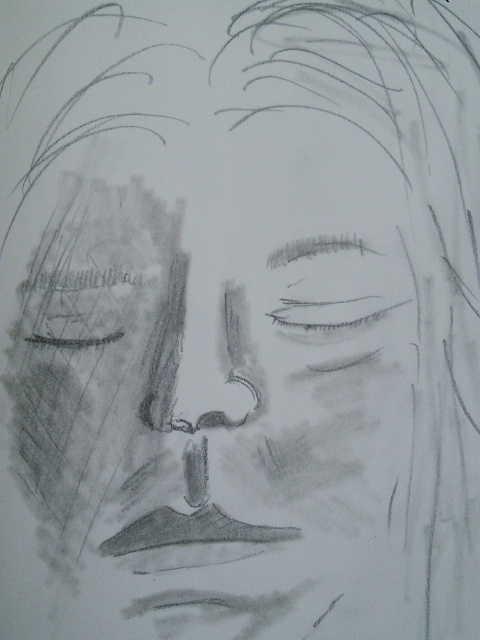
Question: Which of the following is the closest to the observer?

Choices:
 (A) (351, 305)
 (B) (252, 564)
 (C) (199, 422)

Answer: (C)

Question: Considering the relative positions of gray pencil sketch of nose at center and smooth gray nose at center in the image provided, where is gray pencil sketch of nose at center located with respect to smooth gray nose at center?

Choices:
 (A) below
 (B) above

Answer: (B)

Question: Can you confirm if smooth gray eye at center is bigger than smooth gray nose at center?

Choices:
 (A) yes
 (B) no

Answer: (B)

Question: Which object is closer to the camera taking this photo?

Choices:
 (A) smooth gray eye at center
 (B) gray pencil sketch of nose at center
 (C) smooth gray nose at center

Answer: (B)

Question: Where is gray pencil sketch of nose at center located in relation to smooth gray nose at center in the image?

Choices:
 (A) below
 (B) above

Answer: (B)

Question: Which point is farther from the camera taking this photo?

Choices:
 (A) (253, 401)
 (B) (312, 328)
 (C) (231, 452)

Answer: (B)